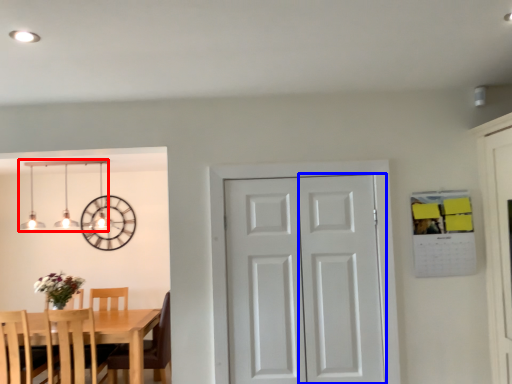
Question: Among these objects, which one is nearest to the camera, lamp (highlighted by a red box) or screen door (highlighted by a blue box)?

Choices:
 (A) lamp
 (B) screen door

Answer: (B)